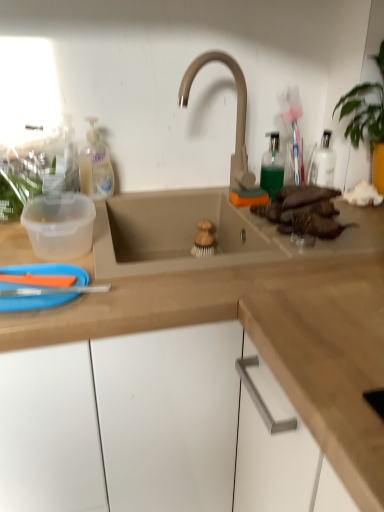
Question: Considering the relative sizes of transparent plastic container at left and brown matte sweet potato at right in the image provided, is transparent plastic container at left wider than brown matte sweet potato at right?

Choices:
 (A) no
 (B) yes

Answer: (A)

Question: Is transparent plastic container at left not near brown matte sweet potato at right?

Choices:
 (A) no
 (B) yes

Answer: (A)

Question: Considering the relative sizes of transparent plastic container at left and brown matte sweet potato at right in the image provided, is transparent plastic container at left smaller than brown matte sweet potato at right?

Choices:
 (A) yes
 (B) no

Answer: (A)

Question: From a real-world perspective, is transparent plastic container at left located higher than brown matte sweet potato at right?

Choices:
 (A) no
 (B) yes

Answer: (A)

Question: Does transparent plastic container at left come in front of brown matte sweet potato at right?

Choices:
 (A) yes
 (B) no

Answer: (A)

Question: Considering the relative sizes of transparent plastic container at left and brown matte sweet potato at right in the image provided, is transparent plastic container at left bigger than brown matte sweet potato at right?

Choices:
 (A) no
 (B) yes

Answer: (A)

Question: Can you confirm if green translucent bottle at upper right is taller than matte beige faucet at center?

Choices:
 (A) yes
 (B) no

Answer: (B)

Question: From the image's perspective, is green translucent bottle at upper right under matte beige faucet at center?

Choices:
 (A) no
 (B) yes

Answer: (B)

Question: Considering the relative sizes of green translucent bottle at upper right and matte beige faucet at center in the image provided, is green translucent bottle at upper right smaller than matte beige faucet at center?

Choices:
 (A) no
 (B) yes

Answer: (B)

Question: Is the depth of green translucent bottle at upper right greater than that of matte beige faucet at center?

Choices:
 (A) no
 (B) yes

Answer: (B)

Question: Is green translucent bottle at upper right at the right side of matte beige faucet at center?

Choices:
 (A) yes
 (B) no

Answer: (A)

Question: From the image's perspective, is green translucent bottle at upper right on matte beige faucet at center?

Choices:
 (A) no
 (B) yes

Answer: (A)

Question: Can you confirm if blue plastic paper plate at lower left is positioned to the right of translucent plastic bottle at upper left?

Choices:
 (A) yes
 (B) no

Answer: (B)